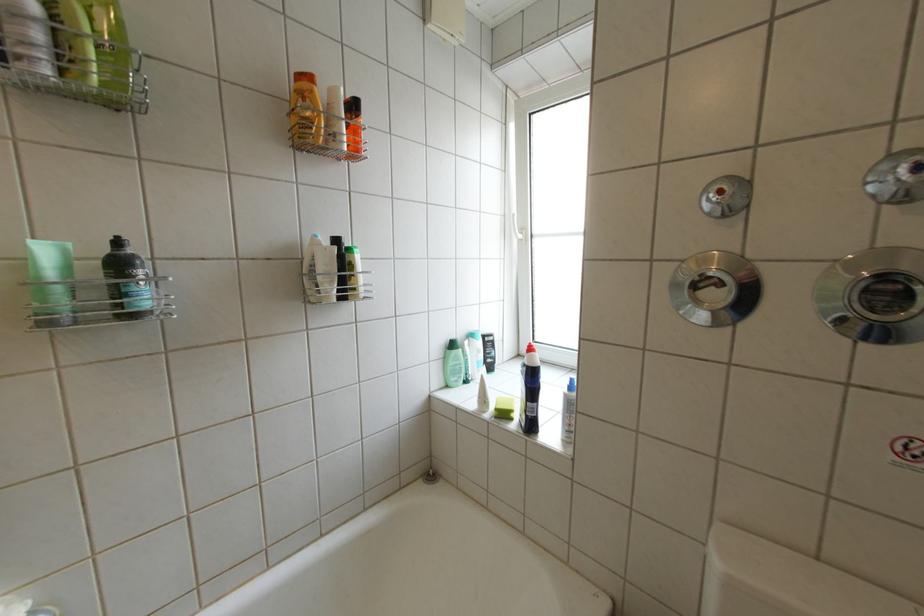
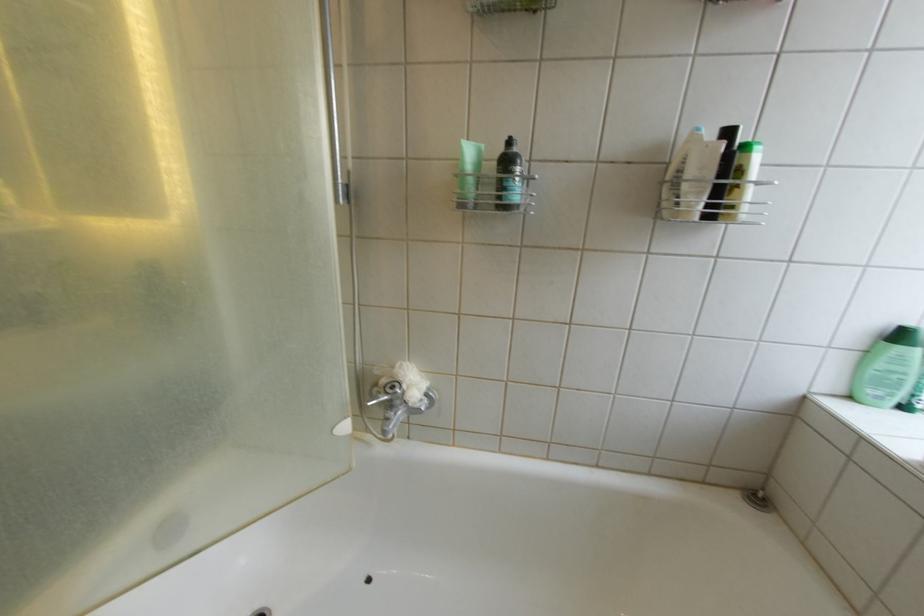
Where in the second image is the point corresponding to [142,278] from the first image?

(524, 174)